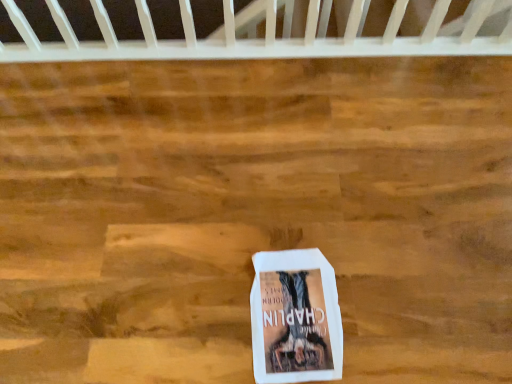
Image resolution: width=512 pixels, height=384 pixels. Identify the location of free region under white plastic crib at upper center (from a real-world perspective). (262, 44).